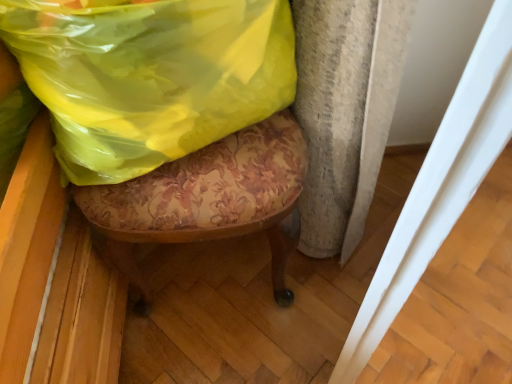
Locate an element on the screen. This screenshot has height=384, width=512. yellow plastic bag at upper center is located at coordinates (150, 77).

This screenshot has width=512, height=384. What do you see at coordinates (150, 77) in the screenshot?
I see `yellow plastic bag at upper center` at bounding box center [150, 77].

The image size is (512, 384). I want to click on yellow plastic bag at upper center, so click(x=150, y=77).